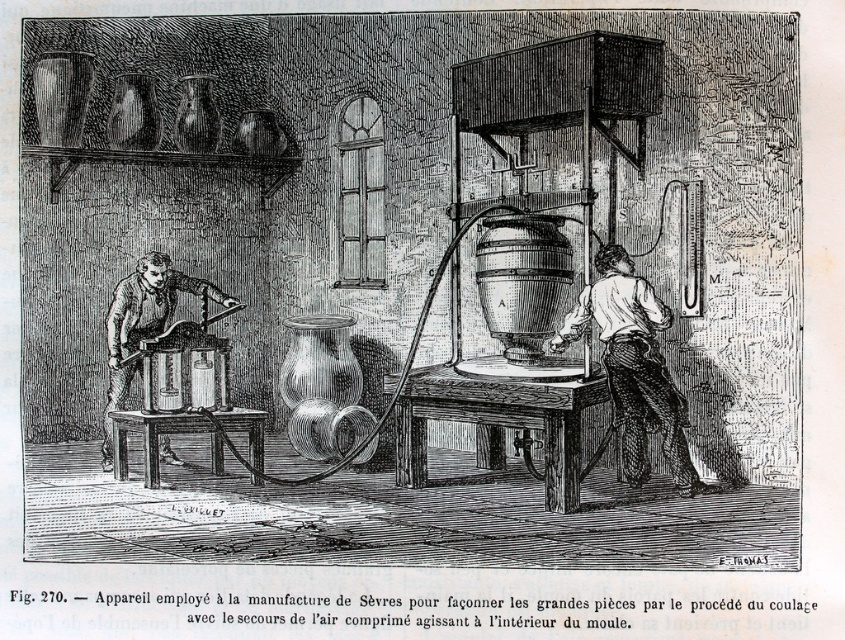
Is white cotton shirt at center smaller than wooden saw at left?

Yes.

In order to click on white cotton shirt at center in this screenshot , I will do click(634, 365).

Where is `white cotton shirt at center`? Image resolution: width=845 pixels, height=640 pixels. white cotton shirt at center is located at coordinates (634, 365).